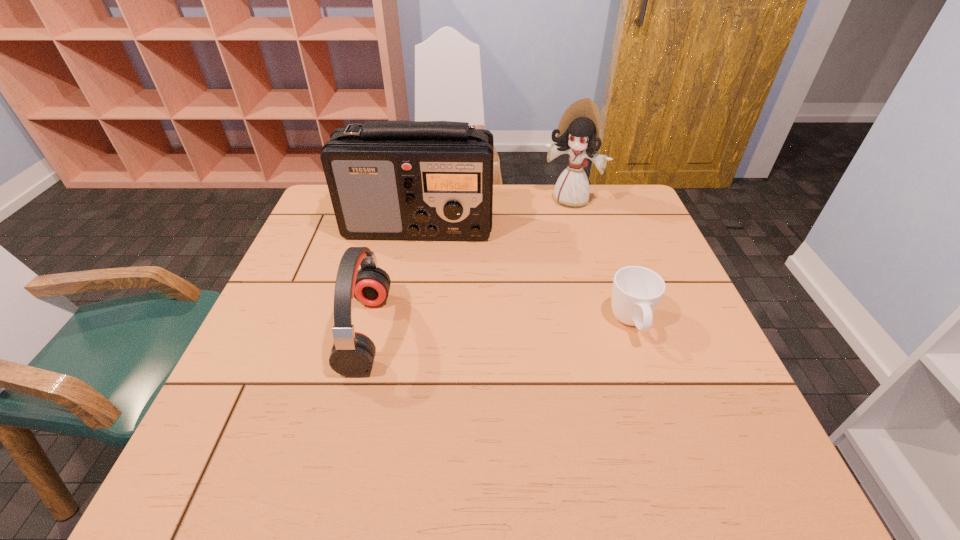
The height and width of the screenshot is (540, 960). Identify the location of vacant space on the desktop that is between the earphone and the cup and is positioned on the front panel of the radio receiver. (492, 328).

I want to click on vacant space on the desktop that is between the earphone and the shortest object and is positioned at the front face of the doll, so click(483, 328).